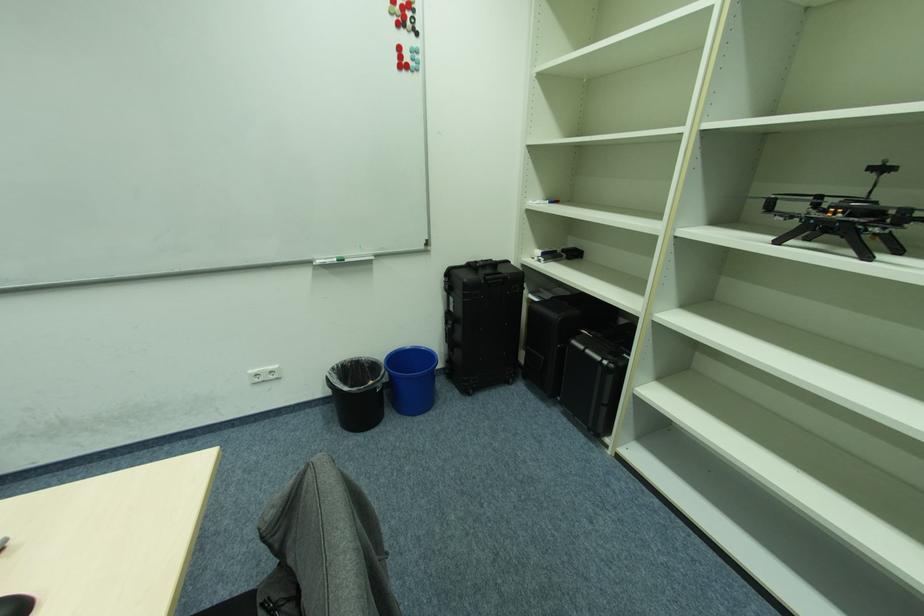
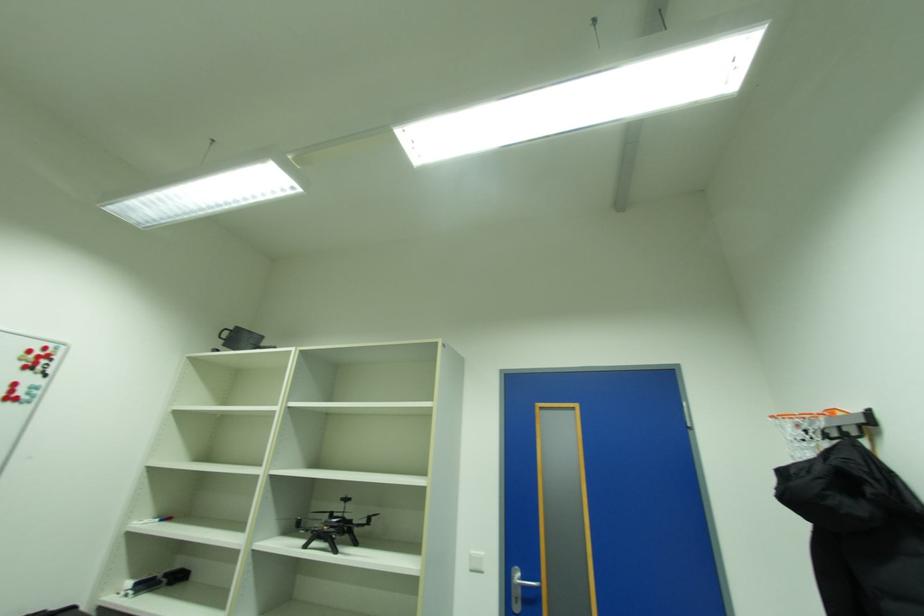
In the scene shown: First-person continuous shooting, in which direction is the camera rotating?

The camera's rotation is toward right-up.